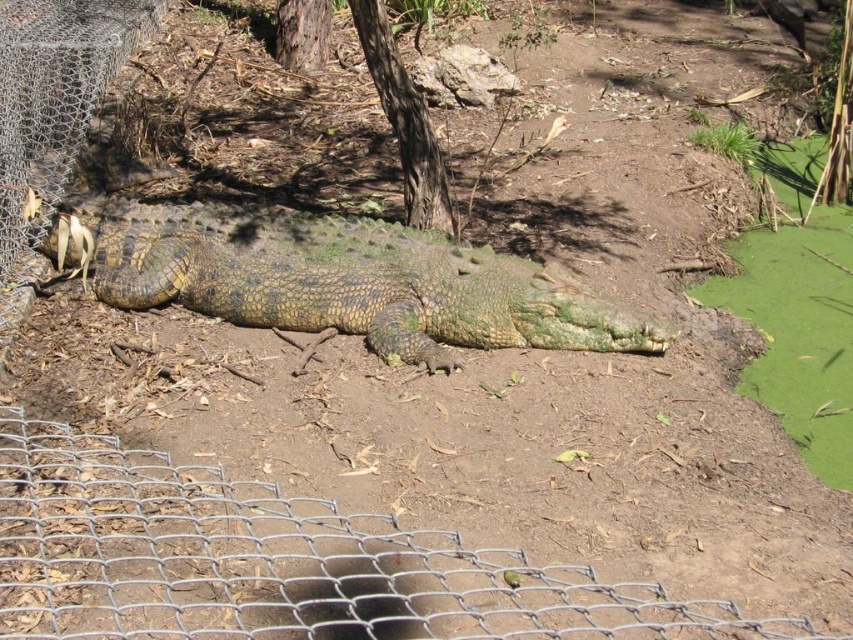
Which is more to the right, wire mesh fence at lower left or green scaly crocodile at center?

wire mesh fence at lower left

Can you confirm if wire mesh fence at lower left is wider than green scaly crocodile at center?

No.

What do you see at coordinates (277, 561) in the screenshot? This screenshot has width=853, height=640. I see `wire mesh fence at lower left` at bounding box center [277, 561].

The height and width of the screenshot is (640, 853). Find the location of `wire mesh fence at lower left`. wire mesh fence at lower left is located at coordinates (277, 561).